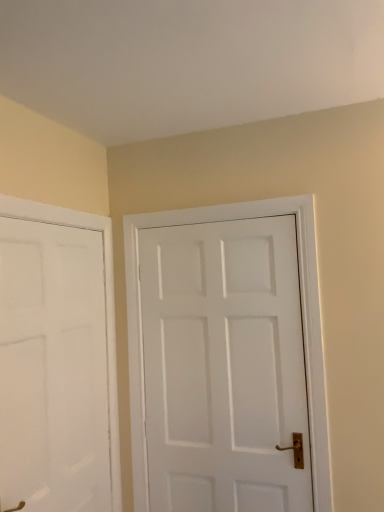
Question: Is white matte door at left, placed as the 2th door when sorted from right to left, bigger or smaller than white matte door at center, which is the 1th door in right-to-left order?

Choices:
 (A) big
 (B) small

Answer: (B)

Question: Considering their positions, is white matte door at left, placed as the 2th door when sorted from right to left, located in front of or behind white matte door at center, which is the 1th door in right-to-left order?

Choices:
 (A) front
 (B) behind

Answer: (A)

Question: Is white matte door at left, placed as the 2th door when sorted from right to left, inside or outside of white matte door at center, which is the 1th door in right-to-left order?

Choices:
 (A) inside
 (B) outside

Answer: (B)

Question: Is point (180, 264) positioned closer to the camera than point (49, 496)?

Choices:
 (A) farther
 (B) closer

Answer: (A)

Question: Considering the positions of white matte door at center, which is the 1th door in right-to-left order, and white matte door at left, acting as the first door starting from the left, in the image, is white matte door at center, which is the 1th door in right-to-left order, wider or thinner than white matte door at left, acting as the first door starting from the left,?

Choices:
 (A) wide
 (B) thin

Answer: (A)

Question: In the image, is white matte door at center, which is the 1th door in right-to-left order, positioned in front of or behind white matte door at left, acting as the first door starting from the left?

Choices:
 (A) behind
 (B) front

Answer: (A)

Question: From the image's perspective, relative to white matte door at left, placed as the 2th door when sorted from right to left, is white matte door at center, which ranks as the 2th door in left-to-right order, above or below?

Choices:
 (A) below
 (B) above

Answer: (B)